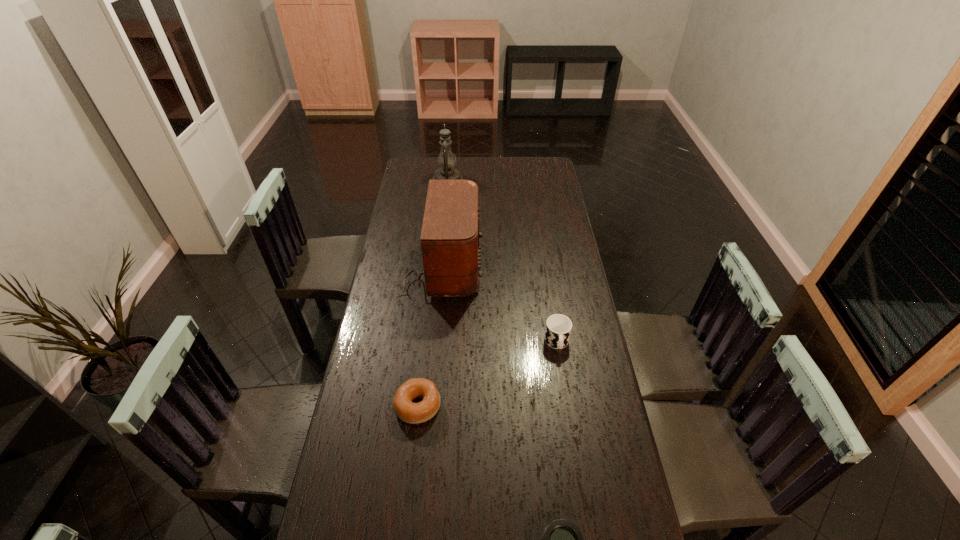
I want to click on the second nearest sunflower, so click(x=420, y=342).

Identify the location of the smallest yellow sunflower. (555, 216).

You are a GUI agent. You are given a task and a screenshot of the screen. Output one action in this format:
    pyautogui.click(x=<x>, y=<y>)
    Task: Click on the nearest object
    This screenshot has width=960, height=540.
    Given the screenshot: What is the action you would take?
    pyautogui.click(x=451, y=490)

This screenshot has width=960, height=540. In order to click on the fourth sunflower from right to left in this screenshot , I will do `click(451, 490)`.

I want to click on blank area located on the label side of the tallest object, so click(x=451, y=181).

You are a GUI agent. You are given a task and a screenshot of the screen. Output one action in this format:
    pyautogui.click(x=<x>, y=<y>)
    Task: Click on the vacant space located on the label side of the tallest object
    The image size is (960, 540).
    Given the screenshot: What is the action you would take?
    pyautogui.click(x=435, y=181)

The image size is (960, 540). I want to click on free space located 0.200m on the label side of the tallest object, so [433, 181].

The height and width of the screenshot is (540, 960). What are the coordinates of `free region located 0.080m on the front-facing side of the third sunflower from right to left` in the screenshot? It's located at (455, 222).

Locate an element on the screen. The height and width of the screenshot is (540, 960). vacant space situated 0.070m on the front-facing side of the third sunflower from right to left is located at coordinates (457, 222).

You are a GUI agent. You are given a task and a screenshot of the screen. Output one action in this format:
    pyautogui.click(x=<x>, y=<y>)
    Task: Click on the vacant space located 0.150m on the front-facing side of the third sunflower from right to left
    This screenshot has height=540, width=960.
    Given the screenshot: What is the action you would take?
    pyautogui.click(x=439, y=222)